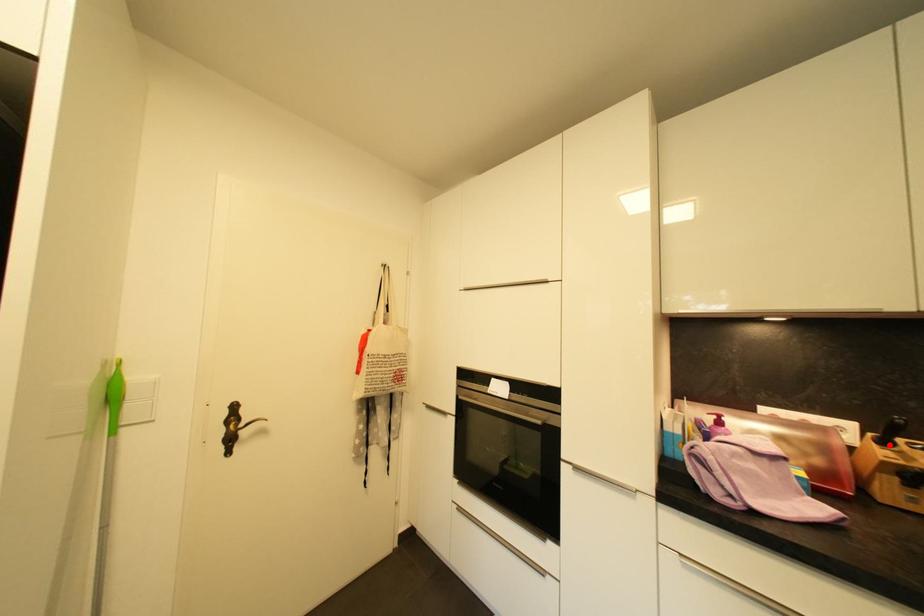
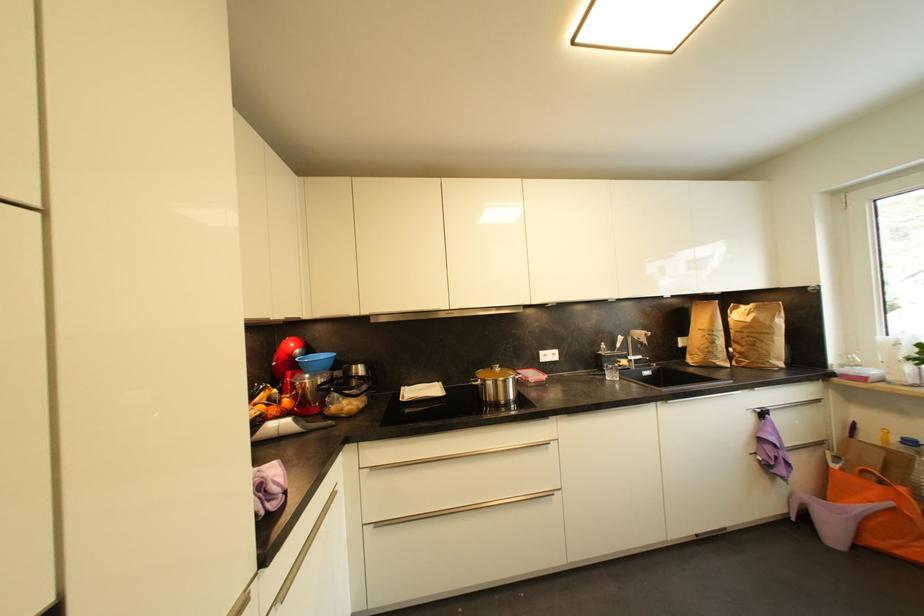
Question: I am providing you with two images of the same scene from different viewpoints. A red point is marked on the first image. At the location where the point appears in image 1, is it still visible in image 2?

Choices:
 (A) Yes
 (B) No

Answer: (B)